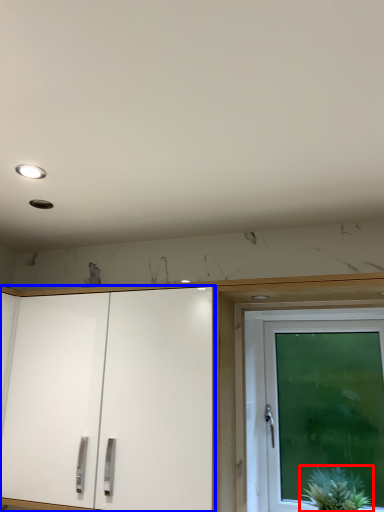
Question: Which object appears farthest to the camera in this image, houseplant (highlighted by a red box) or cabinetry (highlighted by a blue box)?

Choices:
 (A) houseplant
 (B) cabinetry

Answer: (A)